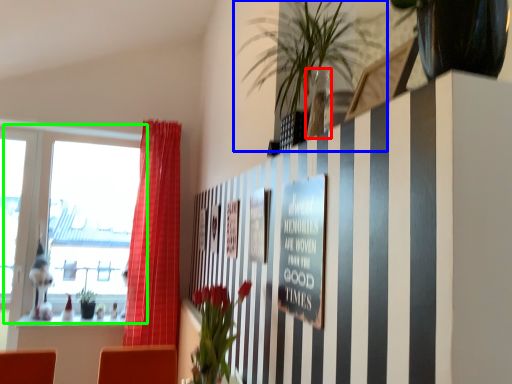
Question: Which object is positioned closest to vase (highlighted by a red box)? Select from houseplant (highlighted by a blue box) and window (highlighted by a green box).

Choices:
 (A) houseplant
 (B) window

Answer: (A)